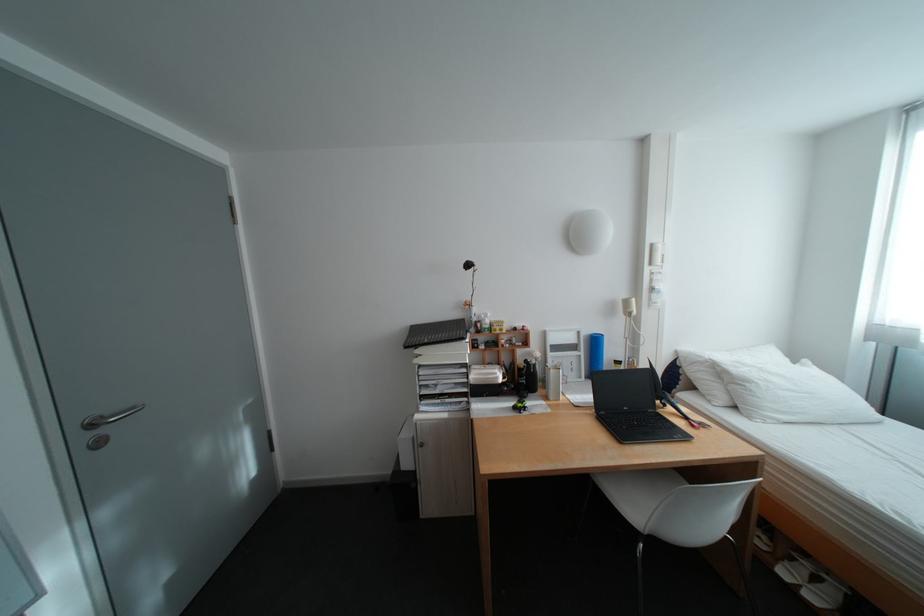
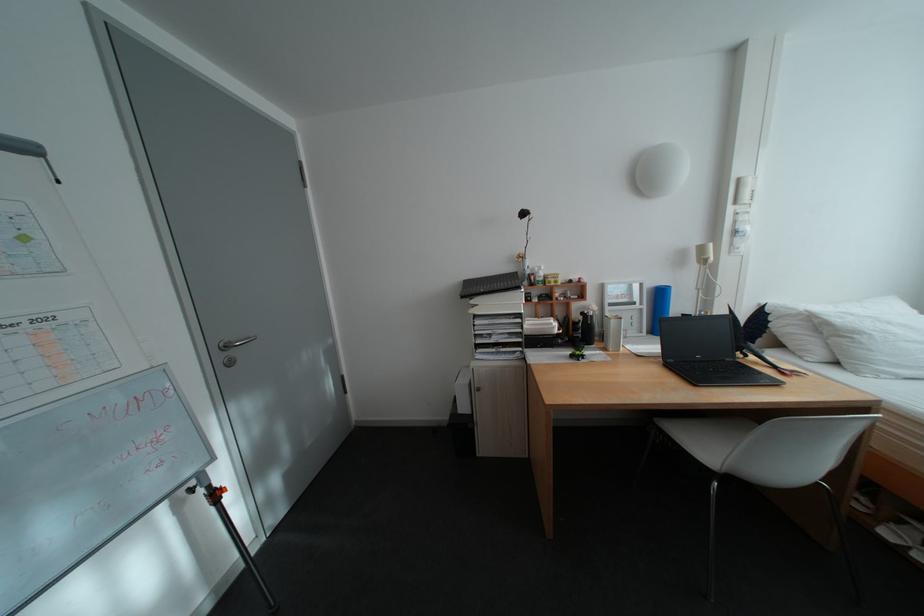
Find the pixel in the second image that matches [99,438] in the first image.

(234, 358)